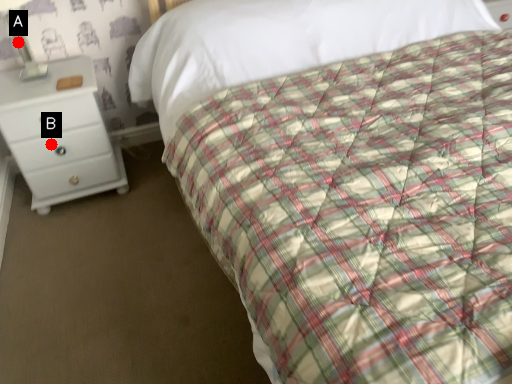
Question: Two points are circled on the image, labeled by A and B beside each circle. Which point is further to the camera?

Choices:
 (A) A is further
 (B) B is further

Answer: (B)